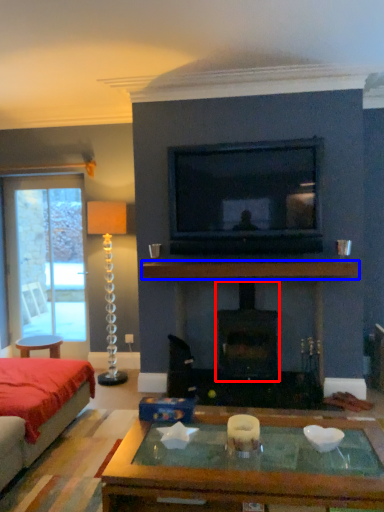
Question: Which point is closer to the camera, fireplace (highlighted by a red box) or mantle (highlighted by a blue box)?

Choices:
 (A) fireplace
 (B) mantle

Answer: (B)